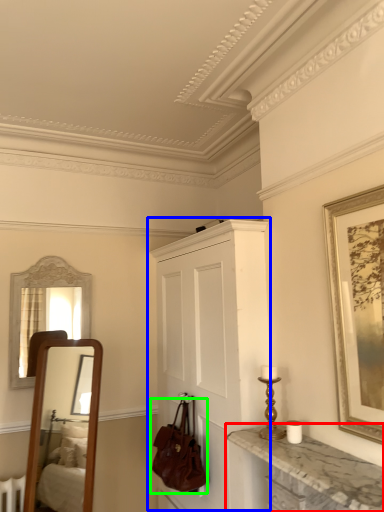
Question: Which object is the farthest from countertop (highlighted by a red box)? Choose among these: cabinetry (highlighted by a blue box) or handbag (highlighted by a green box).

Choices:
 (A) cabinetry
 (B) handbag

Answer: (B)